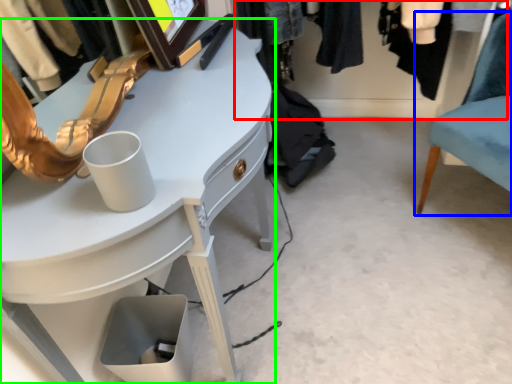
Question: Which object is the closest to the closet (highlighted by a red box)? Choose among these: chair (highlighted by a blue box) or desk (highlighted by a green box).

Choices:
 (A) chair
 (B) desk

Answer: (A)